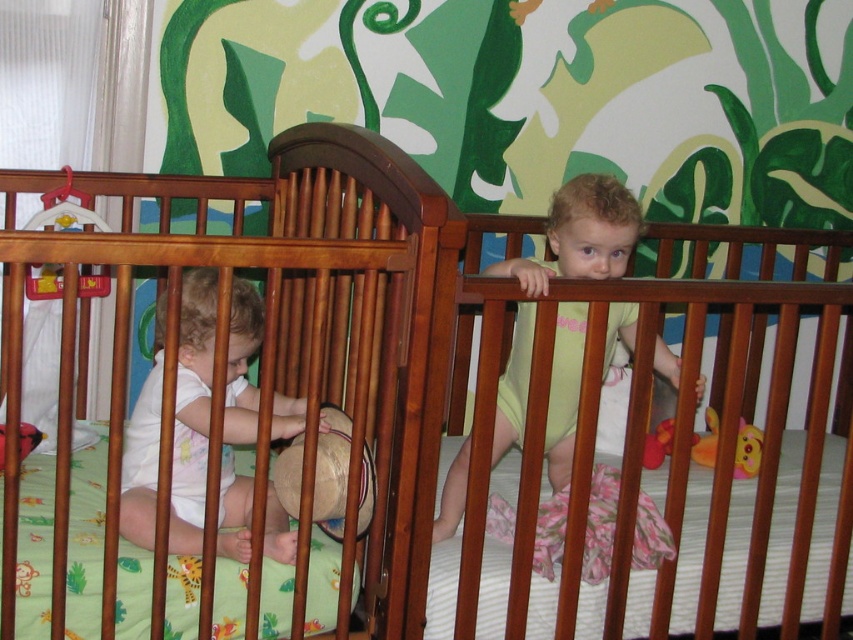
You are a parent trying to locate your child in the nursery. You see the light yellow fabric toddler at upper right and the rubber duck at center. Which object is higher in the image?

The light yellow fabric toddler at upper right is located above the rubber duck at center, so the light yellow fabric toddler at upper right is higher in the image.